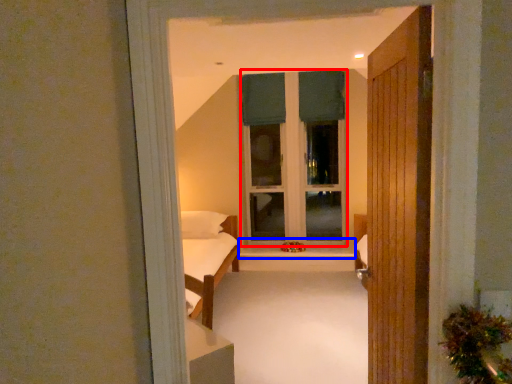
Question: Among these objects, which one is farthest to the camera, window frame (highlighted by a red box) or window sill (highlighted by a blue box)?

Choices:
 (A) window frame
 (B) window sill

Answer: (A)